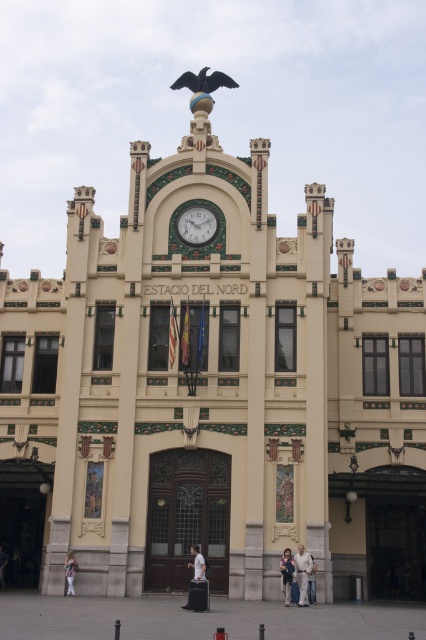
Which is above, green textured clock at center or dark blue jeans at lower center?

green textured clock at center is above.

Consider the image. Who is more distant from viewer, (196,241) or (287,595)?

Positioned behind is point (196,241).

Image resolution: width=426 pixels, height=640 pixels. What are the coordinates of `green textured clock at center` in the screenshot? It's located at (196, 225).

Is green textured clock at center shorter than shiny black eagle at upper center?

Correct, green textured clock at center is not as tall as shiny black eagle at upper center.

Describe the element at coordinates (196, 225) in the screenshot. This screenshot has height=640, width=426. I see `green textured clock at center` at that location.

The height and width of the screenshot is (640, 426). I want to click on green textured clock at center, so click(x=196, y=225).

Between white matte statue at center and white cotton shirt at center, which one has more height?

white cotton shirt at center is taller.

Where is `white matte statue at center`? The image size is (426, 640). white matte statue at center is located at coordinates (198, 563).